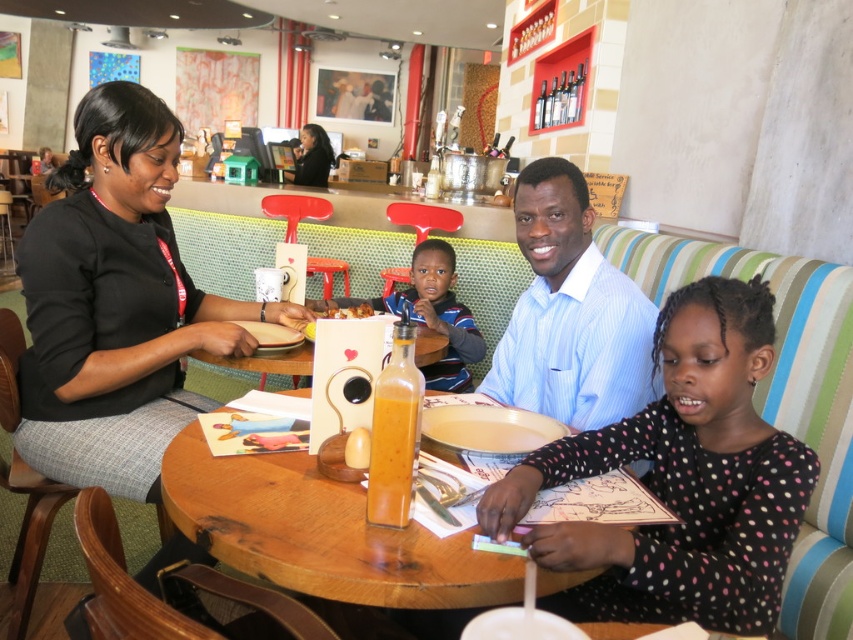
Question: Which object is farther from the camera taking this photo?

Choices:
 (A) yellow matte bread at center
 (B) black dotted shirt at lower right

Answer: (A)

Question: Does matte black hair at upper center appear over yellow matte bread at center?

Choices:
 (A) no
 (B) yes

Answer: (B)

Question: Can you confirm if black dotted shirt at lower right is thinner than wooden table at center?

Choices:
 (A) yes
 (B) no

Answer: (A)

Question: Can you confirm if black matte jacket at left is smaller than black dotted shirt at lower right?

Choices:
 (A) no
 (B) yes

Answer: (A)

Question: Which of the following is the farthest from the observer?

Choices:
 (A) black dotted shirt at lower right
 (B) matte black hair at upper center
 (C) light blue striped shirt at center

Answer: (B)

Question: Which is nearer to the light blue striped shirt at center?

Choices:
 (A) smooth plastic bottle at center
 (B) matte black hair at upper center
 (C) black matte jacket at left

Answer: (A)